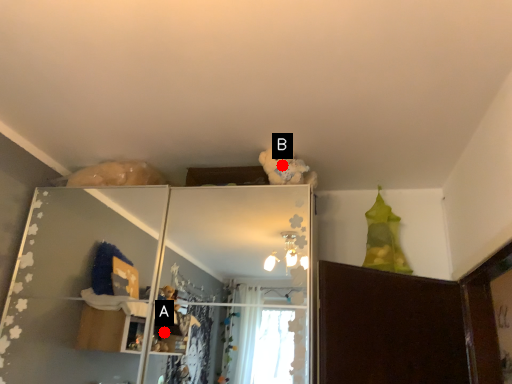
Question: Two points are circled on the image, labeled by A and B beside each circle. Which point is closer to the camera?

Choices:
 (A) A is closer
 (B) B is closer

Answer: (B)